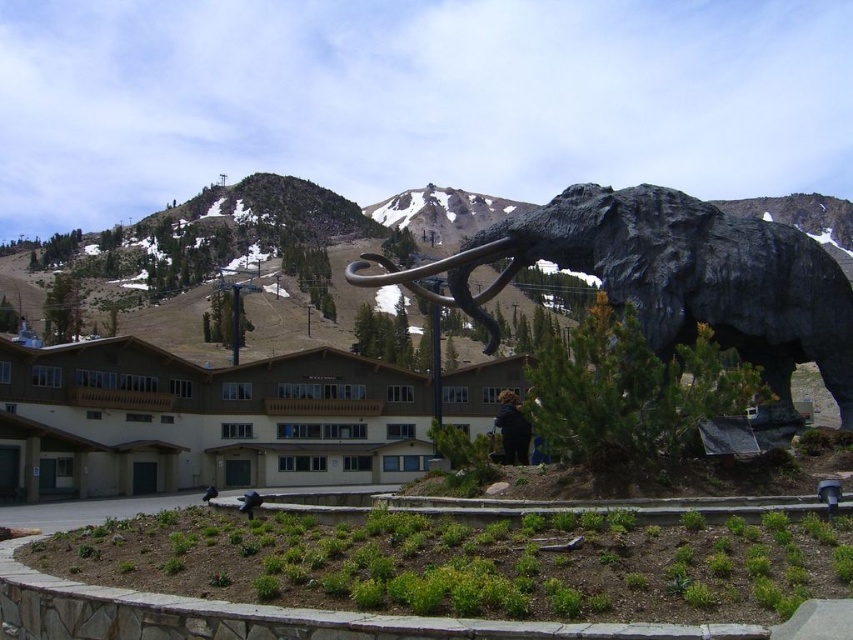
Question: Which is farther from the rugged stone mountain at center?

Choices:
 (A) black polished stone elephant at center
 (B) brown wood hotel at center

Answer: (A)

Question: Which object is closer to the camera taking this photo?

Choices:
 (A) rugged stone mountain at center
 (B) black polished stone elephant at center
 (C) brown wood hotel at center

Answer: (B)

Question: Which object is farther from the camera taking this photo?

Choices:
 (A) brown wood hotel at center
 (B) black polished stone elephant at center

Answer: (A)

Question: Is black polished stone elephant at center to the left of rugged stone mountain at center from the viewer's perspective?

Choices:
 (A) no
 (B) yes

Answer: (B)

Question: Is brown wood hotel at center further to camera compared to rugged stone mountain at center?

Choices:
 (A) yes
 (B) no

Answer: (B)

Question: Does brown wood hotel at center appear on the left side of black polished stone elephant at center?

Choices:
 (A) no
 (B) yes

Answer: (B)